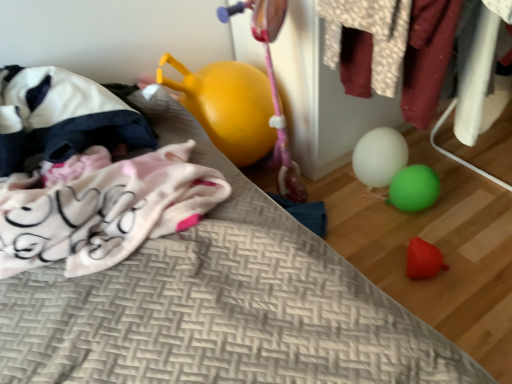
Question: Is white matte balloon at center aimed at velvet fabric clothes at right?

Choices:
 (A) yes
 (B) no

Answer: (B)

Question: Is the position of white matte balloon at center less distant than that of velvet fabric clothes at right?

Choices:
 (A) yes
 (B) no

Answer: (B)

Question: Is white matte balloon at center taller than velvet fabric clothes at right?

Choices:
 (A) yes
 (B) no

Answer: (B)

Question: Is white matte balloon at center at the right side of velvet fabric clothes at right?

Choices:
 (A) no
 (B) yes

Answer: (B)

Question: From the image's perspective, is white matte balloon at center under velvet fabric clothes at right?

Choices:
 (A) yes
 (B) no

Answer: (A)

Question: Is velvet fabric clothes at right located within white matte balloon at center?

Choices:
 (A) yes
 (B) no

Answer: (B)

Question: Considering the relative sizes of velvet fabric clothes at right and white fabric bean bag at left in the image provided, is velvet fabric clothes at right thinner than white fabric bean bag at left?

Choices:
 (A) yes
 (B) no

Answer: (A)

Question: Considering the relative sizes of velvet fabric clothes at right and white fabric bean bag at left in the image provided, is velvet fabric clothes at right shorter than white fabric bean bag at left?

Choices:
 (A) no
 (B) yes

Answer: (A)

Question: Is velvet fabric clothes at right facing towards white fabric bean bag at left?

Choices:
 (A) no
 (B) yes

Answer: (A)

Question: Is velvet fabric clothes at right next to white fabric bean bag at left and touching it?

Choices:
 (A) no
 (B) yes

Answer: (A)

Question: From the image's perspective, does velvet fabric clothes at right appear lower than white fabric bean bag at left?

Choices:
 (A) yes
 (B) no

Answer: (B)

Question: Would you say velvet fabric clothes at right contains white fabric bean bag at left?

Choices:
 (A) yes
 (B) no

Answer: (B)

Question: Is white fabric bean bag at left beside white matte balloon at center?

Choices:
 (A) no
 (B) yes

Answer: (A)